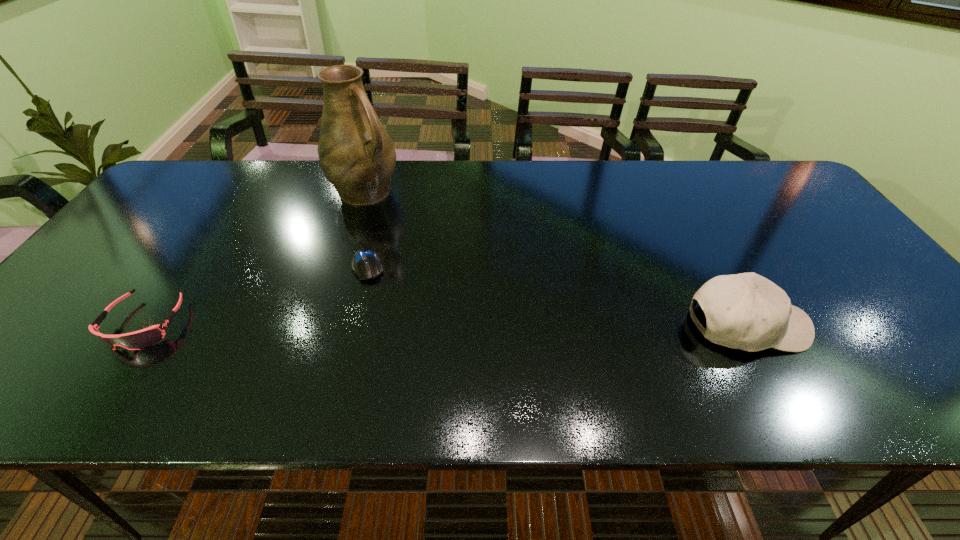
At what (x,y) coordinates should I click in order to perform the action: click on free space located on the handle side of the pitcher. Please return your answer as a coordinate pair (x, y). The height and width of the screenshot is (540, 960). Looking at the image, I should click on (423, 237).

Find the location of a particular element. blank area located on the handle side of the pitcher is located at coordinates (425, 239).

Where is `vacant space located on the button side of the computer mouse`? vacant space located on the button side of the computer mouse is located at coordinates (375, 301).

Locate an element on the screen. The width and height of the screenshot is (960, 540). vacant space located on the button side of the computer mouse is located at coordinates (381, 323).

At what (x,y) coordinates should I click in order to perform the action: click on vacant space located on the button side of the computer mouse. Please return your answer as a coordinate pair (x, y). Image resolution: width=960 pixels, height=540 pixels. Looking at the image, I should click on (386, 340).

Where is `object that is at the far edge`? object that is at the far edge is located at coordinates (357, 156).

This screenshot has height=540, width=960. Find the location of `goggles situated at the near edge`. goggles situated at the near edge is located at coordinates (137, 340).

The width and height of the screenshot is (960, 540). I want to click on baseball cap that is at the near edge, so click(746, 311).

Where is `object that is at the left edge`? object that is at the left edge is located at coordinates (137, 340).

Locate an element on the screen. This screenshot has height=540, width=960. object located in the near left corner section of the desktop is located at coordinates (137, 340).